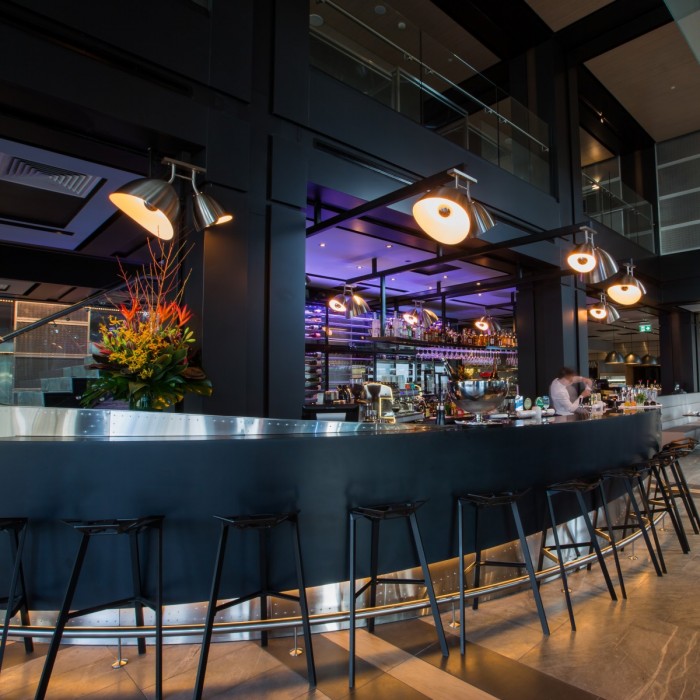
What are the coordinates of `purpled lighting` in the screenshot? It's located at (358, 260).